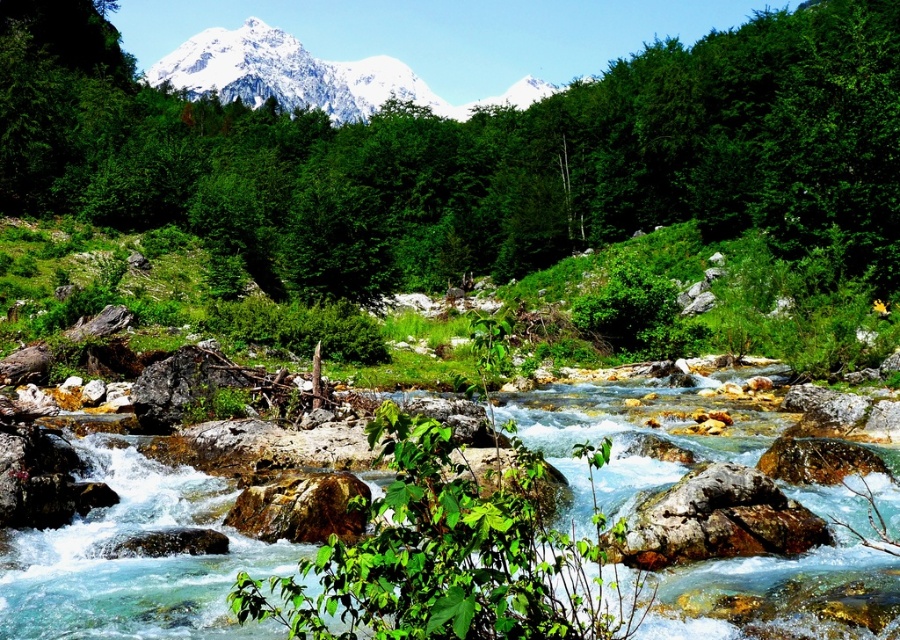
Question: Which point is farther to the camera?

Choices:
 (A) rusty metallic boulder at center-right
 (B) green leafy tree at center

Answer: (B)

Question: Which of the following is the farthest from the observer?

Choices:
 (A) snowy white mountain at upper center
 (B) rusty metallic boulder at center-right

Answer: (A)

Question: Can you confirm if green leafy tree at center is thinner than snowy white mountain at upper center?

Choices:
 (A) no
 (B) yes

Answer: (B)

Question: Can you confirm if snowy white mountain at upper center is positioned to the left of rusty metallic boulder at center-right?

Choices:
 (A) no
 (B) yes

Answer: (B)

Question: Based on their relative distances, which object is nearer to the snowy white mountain at upper center?

Choices:
 (A) rusty metallic boulder at center-right
 (B) green leafy tree at center

Answer: (B)

Question: Is the position of green leafy tree at center more distant than that of rusty metallic boulder at center-right?

Choices:
 (A) no
 (B) yes

Answer: (B)